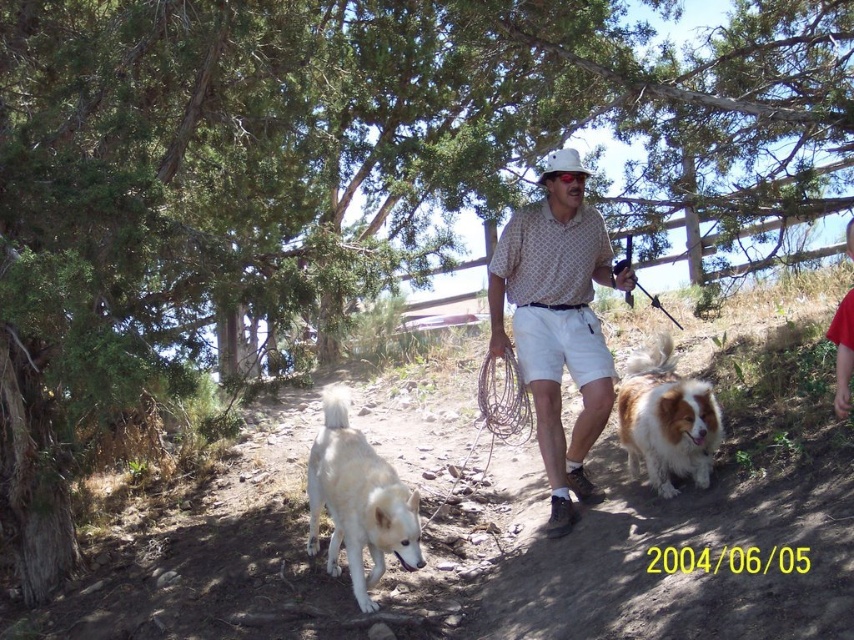
In the scene shown: Is polka dot shirt at center to the right of brown fluffy dog at center from the viewer's perspective?

Incorrect, polka dot shirt at center is not on the right side of brown fluffy dog at center.

Which is behind, point (568, 268) or point (674, 406)?

The point (568, 268) is behind.

Measure the distance between polka dot shirt at center and camera.

polka dot shirt at center and camera are 4.91 meters apart from each other.

Locate an element on the screen. polka dot shirt at center is located at coordinates (559, 321).

In the scene shown: Is white fur dog at lower left to the left of brown fluffy dog at center from the viewer's perspective?

Yes, white fur dog at lower left is to the left of brown fluffy dog at center.

Between white fur dog at lower left and brown fluffy dog at center, which one has more height?

white fur dog at lower left is taller.

Between point (344, 540) and point (633, 472), which one is positioned in front?

Point (344, 540)

Where is `white fur dog at lower left`? The height and width of the screenshot is (640, 854). white fur dog at lower left is located at coordinates (358, 500).

Does polka dot shirt at center have a lesser height compared to white fur dog at lower left?

In fact, polka dot shirt at center may be taller than white fur dog at lower left.

Is point (581, 422) farther from viewer compared to point (320, 435)?

That is True.

Locate an element on the screen. The width and height of the screenshot is (854, 640). polka dot shirt at center is located at coordinates (559, 321).